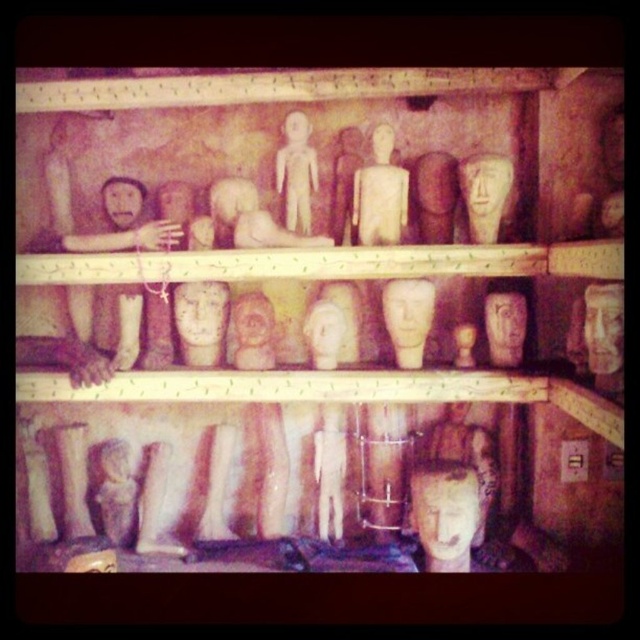
Is matte wood figure at center above matte wooden figure at upper center?

Incorrect, matte wood figure at center is not positioned above matte wooden figure at upper center.

Does matte wood figure at center have a greater width compared to matte wooden figure at upper center?

Yes, matte wood figure at center is wider than matte wooden figure at upper center.

This screenshot has height=640, width=640. What do you see at coordinates (380, 193) in the screenshot?
I see `matte wood figure at center` at bounding box center [380, 193].

Locate an element on the screen. This screenshot has height=640, width=640. matte wood figure at center is located at coordinates (x=380, y=193).

Is matte wooden figure at upper center to the left of matte clay mask at center from the viewer's perspective?

No, matte wooden figure at upper center is not to the left of matte clay mask at center.

The image size is (640, 640). In order to click on matte wooden figure at upper center in this screenshot , I will do `click(296, 172)`.

Is point (369, 218) closer to viewer compared to point (472, 195)?

No.

Can you confirm if matte wood figure at center is shorter than matte wood mask at upper right?

No.

Is point (387, 230) more distant than point (474, 154)?

No.

The width and height of the screenshot is (640, 640). Identify the location of matte wood figure at center. (380, 193).